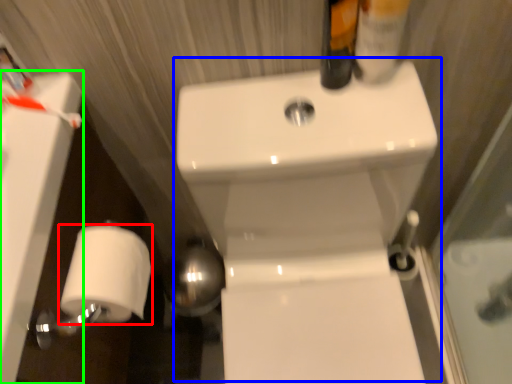
Question: Estimate the real-world distances between objects in this image. Which object is farther from toilet paper (highlighted by a red box), sink (highlighted by a blue box) or bath (highlighted by a green box)?

Choices:
 (A) sink
 (B) bath

Answer: (A)